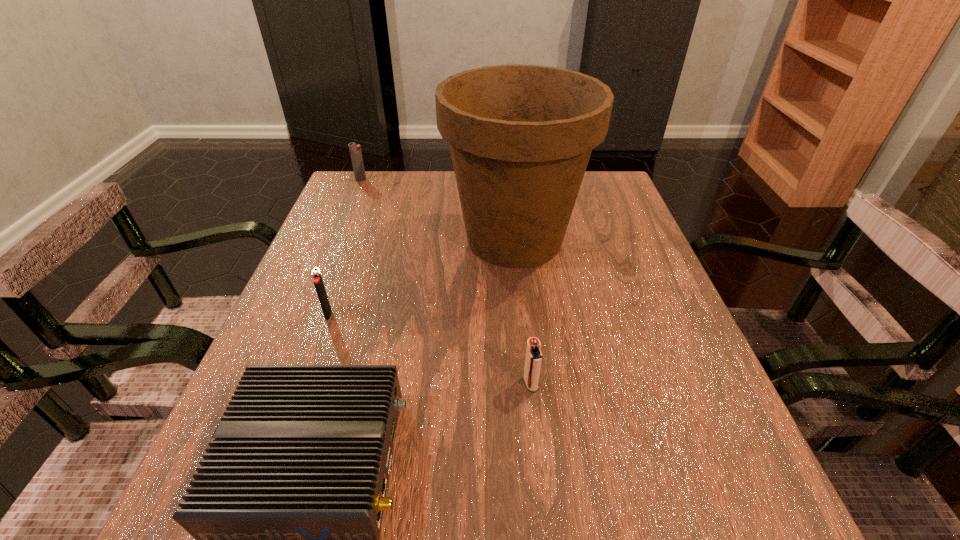
Where is `vacant space at the right edge of the desktop`? The height and width of the screenshot is (540, 960). vacant space at the right edge of the desktop is located at coordinates (576, 237).

The width and height of the screenshot is (960, 540). I want to click on vacant area at the far left corner of the desktop, so click(x=373, y=188).

Where is `free space at the far right corner of the desktop`? free space at the far right corner of the desktop is located at coordinates (606, 199).

At what (x,y) coordinates should I click in order to perform the action: click on empty space between the farthest object and the tallest object. Please return your answer as a coordinate pair (x, y). The width and height of the screenshot is (960, 540). Looking at the image, I should click on (438, 209).

The image size is (960, 540). Find the location of `vacant region between the leftmost igniter and the fourth nearest object`. vacant region between the leftmost igniter and the fourth nearest object is located at coordinates (438, 209).

Image resolution: width=960 pixels, height=540 pixels. Identify the location of free spot between the second igniter from left to right and the nearest igniter. (429, 349).

What are the coordinates of `vacant space that's between the farthest object and the second farthest igniter` in the screenshot? It's located at 345,247.

Where is `vacant space that's between the flowerpot and the second nearest object`? Image resolution: width=960 pixels, height=540 pixels. vacant space that's between the flowerpot and the second nearest object is located at coordinates (522, 311).

Identify the location of free space between the second igniter from left to right and the fourth nearest object. (421, 276).

The image size is (960, 540). Find the location of `object that is the second closest one to the farthest igniter`. object that is the second closest one to the farthest igniter is located at coordinates (317, 278).